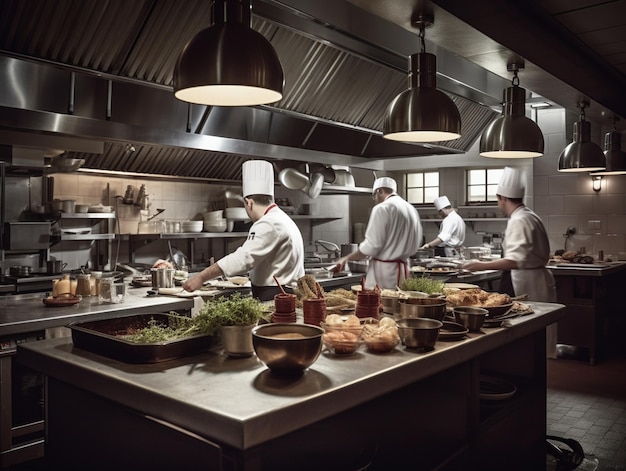
The image size is (626, 471). I want to click on grill vent, so click(178, 160).